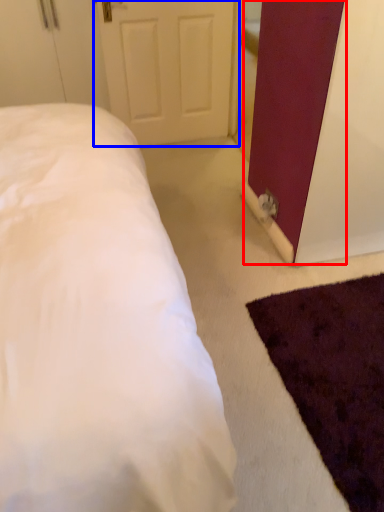
Question: Which of the following is the farthest to the observer, barn door (highlighted by a red box) or door (highlighted by a blue box)?

Choices:
 (A) barn door
 (B) door

Answer: (B)